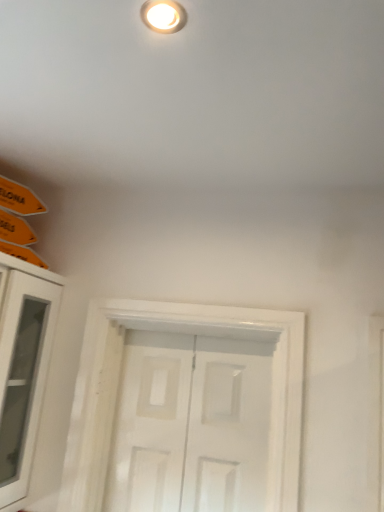
Question: Considering the relative positions of white matte door at center and white glass cabinet at left in the image provided, is white matte door at center to the left or to the right of white glass cabinet at left?

Choices:
 (A) right
 (B) left

Answer: (A)

Question: Choose the correct answer: Is white matte door at center inside white glass cabinet at left or outside it?

Choices:
 (A) outside
 (B) inside

Answer: (A)

Question: Is point (144, 496) positioned closer to the camera than point (24, 411)?

Choices:
 (A) farther
 (B) closer

Answer: (A)

Question: In the image, is white glass cabinet at left positioned in front of or behind white matte door at center?

Choices:
 (A) front
 (B) behind

Answer: (A)

Question: Is point (41, 272) closer or farther from the camera than point (152, 402)?

Choices:
 (A) closer
 (B) farther

Answer: (A)

Question: From the image's perspective, is white glass cabinet at left above or below white matte door at center?

Choices:
 (A) below
 (B) above

Answer: (B)

Question: From their relative heights in the image, would you say white glass cabinet at left is taller or shorter than white matte door at center?

Choices:
 (A) tall
 (B) short

Answer: (A)